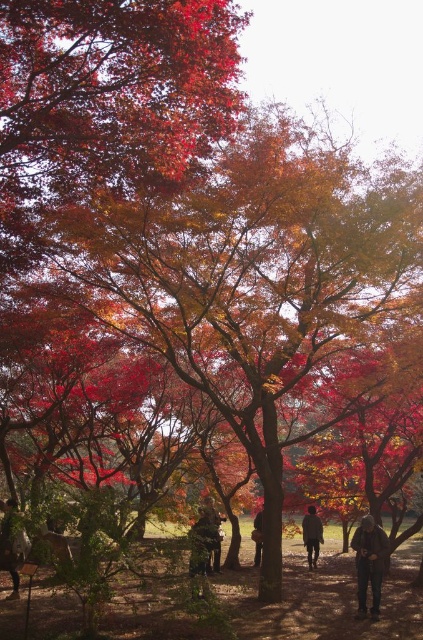
Does dark brown leather jacket at lower left appear on the left side of dark gray sweater at center?

Correct, you'll find dark brown leather jacket at lower left to the left of dark gray sweater at center.

What do you see at coordinates (11, 545) in the screenshot? I see `dark brown leather jacket at lower left` at bounding box center [11, 545].

Is point (14, 515) in front of point (260, 540)?

Yes, it is in front of point (260, 540).

Locate an element on the screen. dark brown leather jacket at lower left is located at coordinates (11, 545).

Consider the image. Who is positioned more to the right, dark green textured jacket at center or dark gray sweater at center?

Positioned to the right is dark gray sweater at center.

Is point (211, 531) positioned behind point (260, 513)?

No, (211, 531) is closer to viewer.

Which is in front, point (200, 532) or point (253, 518)?

Point (200, 532)

Where is `dark green textured jacket at center`? dark green textured jacket at center is located at coordinates (203, 541).

Is dark green textured jacket at center below dark brown leather jacket at center?

Incorrect, dark green textured jacket at center is not positioned below dark brown leather jacket at center.

Does point (194, 570) come in front of point (304, 518)?

Yes, it is in front of point (304, 518).

Locate an element on the screen. The height and width of the screenshot is (640, 423). dark green textured jacket at center is located at coordinates (203, 541).